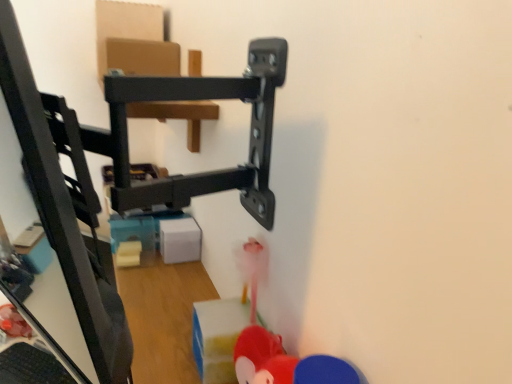
Question: From a real-world perspective, relative to rubberized red toy at lower center, acting as the 2th toy starting from the back, is black plastic keyboard at lower left vertically above or below?

Choices:
 (A) below
 (B) above

Answer: (A)

Question: Considering the positions of black plastic keyboard at lower left and rubberized red toy at lower center, the second toy viewed from the left, in the image, is black plastic keyboard at lower left wider or thinner than rubberized red toy at lower center, the second toy viewed from the left,?

Choices:
 (A) thin
 (B) wide

Answer: (B)

Question: Which object is the farthest from the black plastic keyboard at lower left?

Choices:
 (A) rubberized red toy at lower right, acting as the third toy starting from the left
 (B) translucent plastic toy at lower left, acting as the first toy starting from the back
 (C) rubberized red toy at lower center, marked as the 2th toy in a front-to-back arrangement

Answer: (A)

Question: Based on their relative distances, which object is farther from the rubberized red toy at lower right, which ranks as the first toy in right-to-left order?

Choices:
 (A) black plastic keyboard at lower left
 (B) translucent plastic toy at lower left, acting as the first toy starting from the back
 (C) rubberized red toy at lower center, acting as the 2th toy starting from the back

Answer: (B)